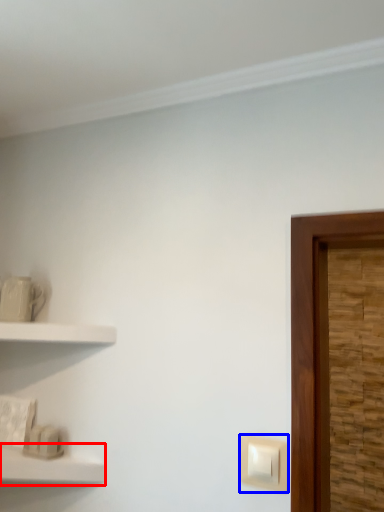
Question: Which of the following is the farthest to the observer, shelf (highlighted by a red box) or light switch (highlighted by a blue box)?

Choices:
 (A) shelf
 (B) light switch

Answer: (B)